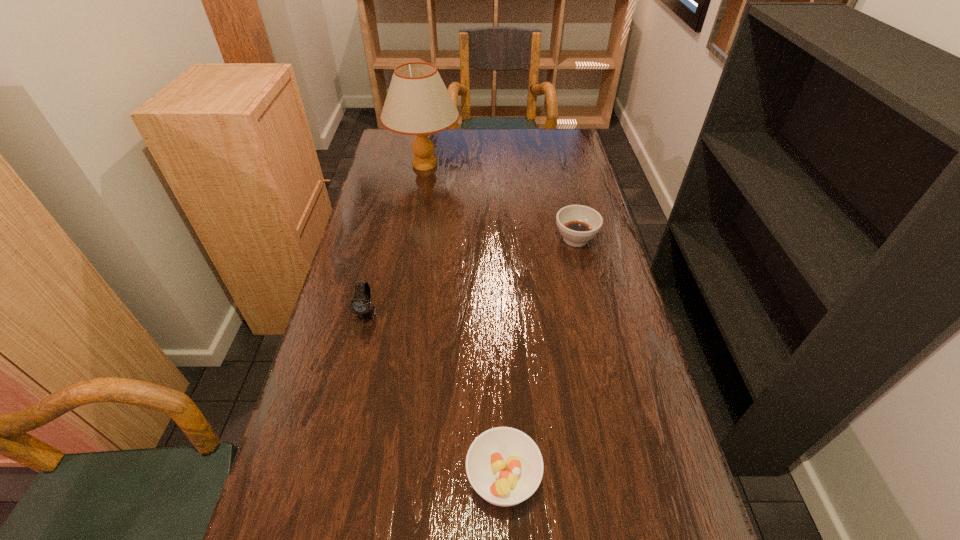
At what (x,y) coordinates should I click in order to perform the action: click on free point between the nearer soup bowl and the third farthest object. Please return your answer as a coordinate pair (x, y). Image resolution: width=960 pixels, height=540 pixels. Looking at the image, I should click on (435, 396).

Find the location of a particular element. vacant point located between the left soup bowl and the tallest object is located at coordinates (464, 321).

Identify the location of blank region between the lampshade and the second tallest object. The width and height of the screenshot is (960, 540). coord(396,239).

At what (x,y) coordinates should I click in order to perform the action: click on blank region between the third shortest object and the tallest object. Please return your answer as a coordinate pair (x, y). Looking at the image, I should click on (396, 239).

You are a GUI agent. You are given a task and a screenshot of the screen. Output one action in this format:
    pyautogui.click(x=<x>, y=<y>)
    Task: Click on the free point between the lampshade and the shorter soup bowl
    
    Given the screenshot: What is the action you would take?
    pyautogui.click(x=464, y=321)

Where is `unoccupied position between the farthest object and the shortest object`? unoccupied position between the farthest object and the shortest object is located at coordinates pyautogui.click(x=464, y=321).

The height and width of the screenshot is (540, 960). I want to click on vacant region between the third farthest object and the right soup bowl, so click(x=471, y=276).

Find the location of a particular element. The width and height of the screenshot is (960, 540). free point between the lampshade and the nearest object is located at coordinates (464, 321).

This screenshot has width=960, height=540. I want to click on vacant area between the farther soup bowl and the second nearest object, so click(471, 276).

Choose which object is the nearest neighbor to the tallest object. Please provide its 2D coordinates. Your answer should be formatted as a tuple, i.e. [(x, y)], where the tuple contains the x and y coordinates of a point satisfying the conditions above.

[(578, 224)]